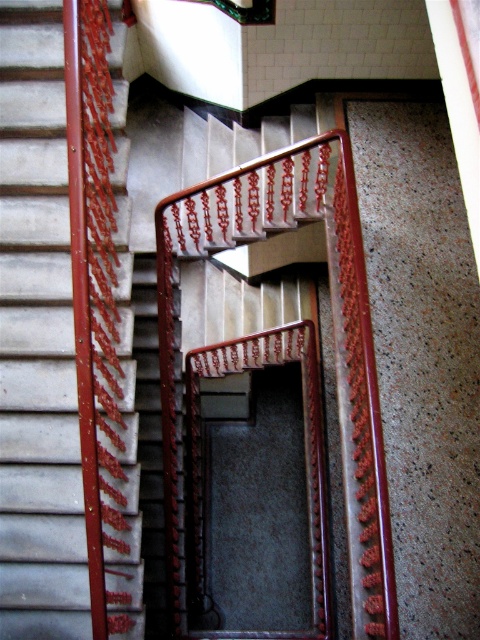
You are standing at the top of the staircase and looking down. You see two points marked on the steps. Which point, point (37, 422) or point (335, 291), is closer to you?

Point (37, 422) is closer to the camera than point (335, 291), so it is closer to you.